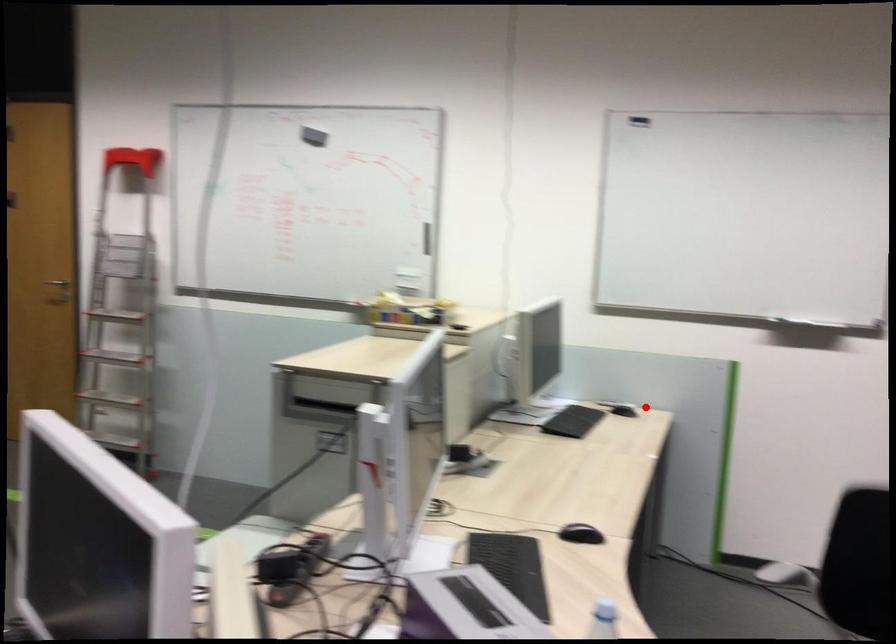
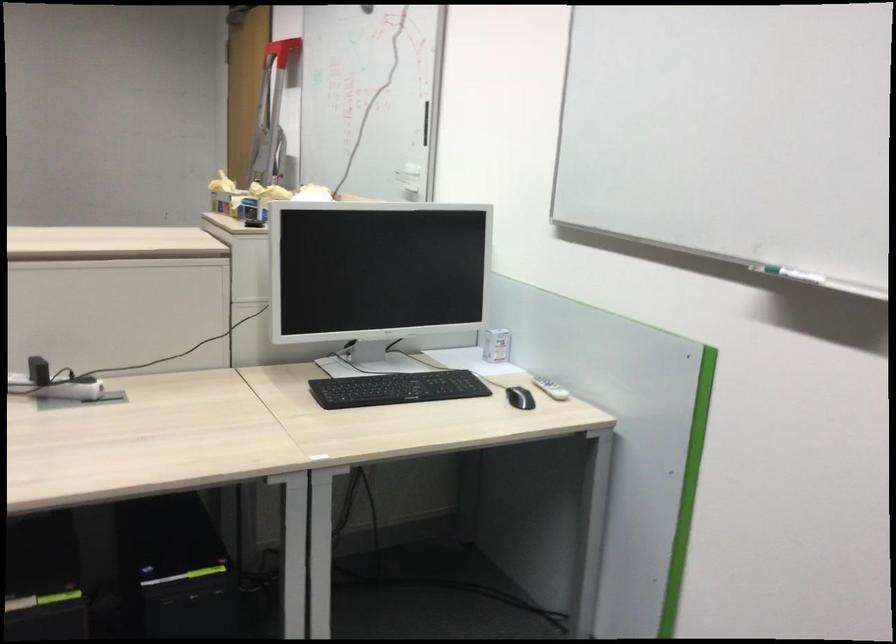
Question: I am providing you with two images of the same scene from different viewpoints. Given a red point in image1, look at the same physical point in image2. Is it:

Choices:
 (A) Closer to the viewpoint
 (B) Farther from the viewpoint

Answer: (A)